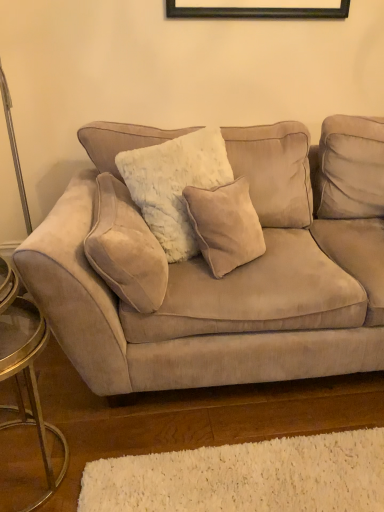
Question: Is beige suede pillow at left taller or shorter than suede couch at center?

Choices:
 (A) tall
 (B) short

Answer: (B)

Question: Considering the positions of beige suede pillow at left and suede couch at center in the image, is beige suede pillow at left wider or thinner than suede couch at center?

Choices:
 (A) wide
 (B) thin

Answer: (B)

Question: Estimate the real-world distances between objects in this image. Which object is closer to the suede couch at center?

Choices:
 (A) metallic gold side table at left
 (B) beige suede pillow at left
 (C) white shag rug at lower center

Answer: (B)

Question: Which is nearer to the beige suede pillow at left?

Choices:
 (A) white shag rug at lower center
 (B) metallic gold side table at left
 (C) suede couch at center

Answer: (C)